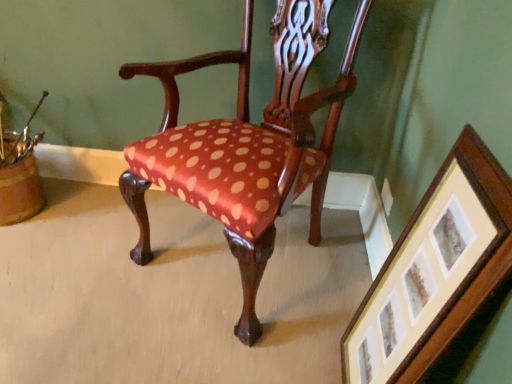
Question: Do you think wooden picture frame at lower right is within satin-polka dot chair at center, or outside of it?

Choices:
 (A) inside
 (B) outside

Answer: (B)

Question: Is point (460, 180) closer or farther from the camera than point (251, 188)?

Choices:
 (A) closer
 (B) farther

Answer: (A)

Question: Considering the positions of wooden picture frame at lower right and satin-polka dot chair at center in the image, is wooden picture frame at lower right wider or thinner than satin-polka dot chair at center?

Choices:
 (A) wide
 (B) thin

Answer: (B)

Question: Is point (193, 162) positioned closer to the camera than point (406, 276)?

Choices:
 (A) farther
 (B) closer

Answer: (A)

Question: Considering the positions of satin-polka dot chair at center and wooden picture frame at lower right in the image, is satin-polka dot chair at center wider or thinner than wooden picture frame at lower right?

Choices:
 (A) thin
 (B) wide

Answer: (B)

Question: Based on their sizes in the image, would you say satin-polka dot chair at center is bigger or smaller than wooden picture frame at lower right?

Choices:
 (A) big
 (B) small

Answer: (A)

Question: From the image's perspective, is satin-polka dot chair at center located above or below wooden picture frame at lower right?

Choices:
 (A) above
 (B) below

Answer: (A)